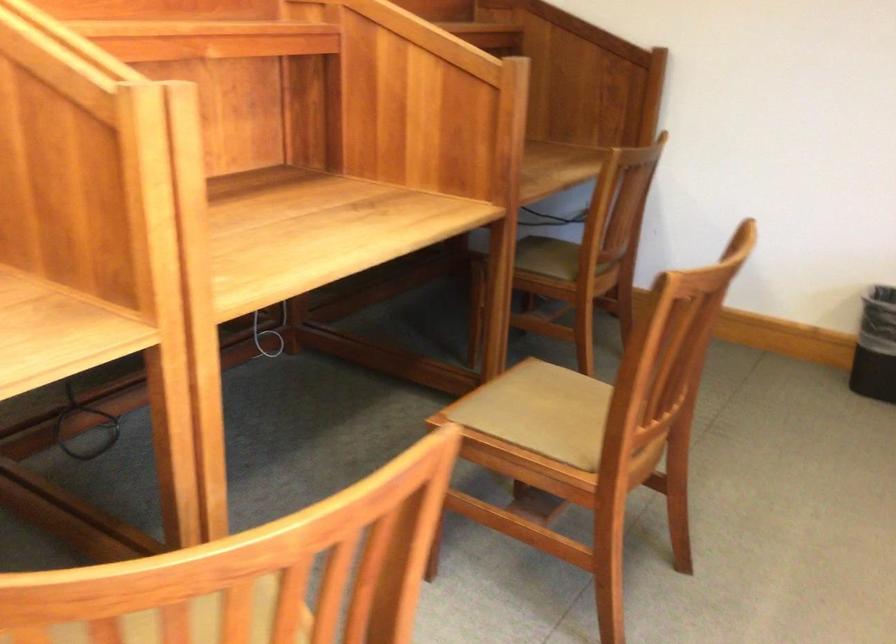
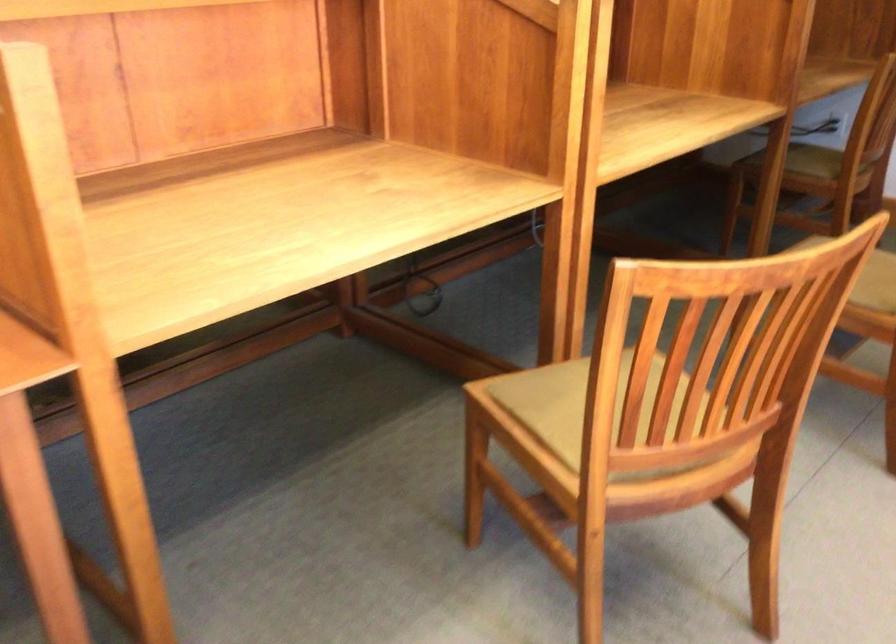
Locate, in the second image, the point that corresponds to the point at 563,436 in the first image.

(869, 275)